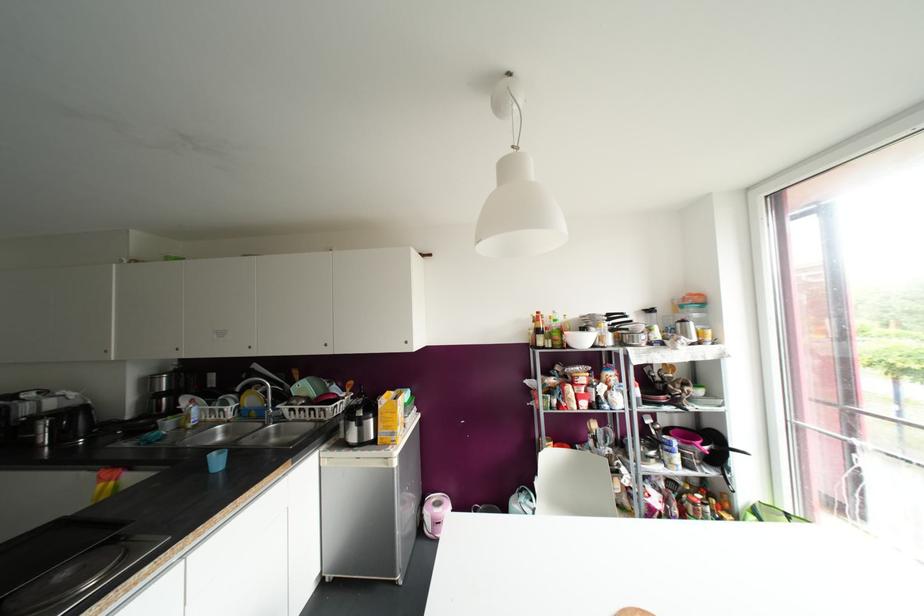
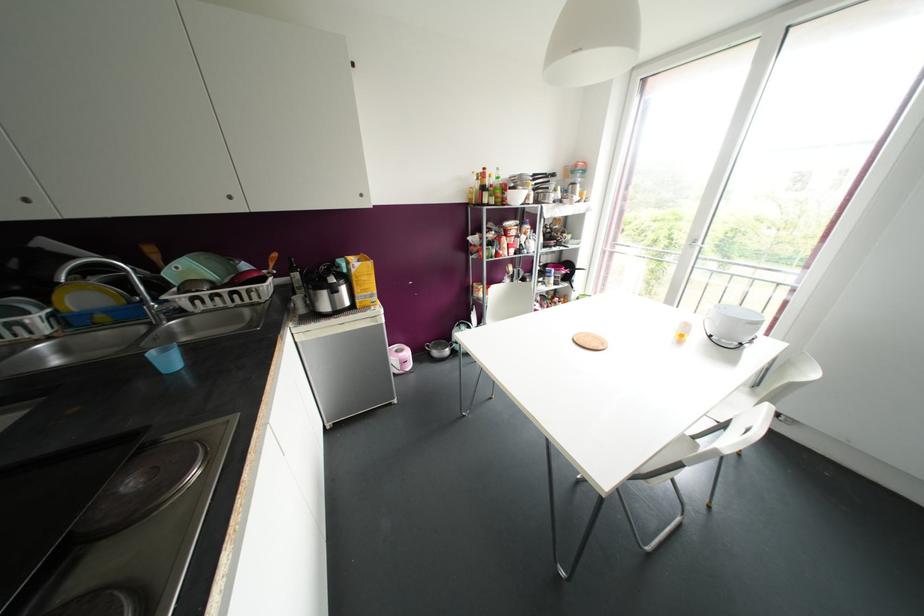
In the second image, find the point that corresponds to pixel 690 323 in the first image.

(578, 185)